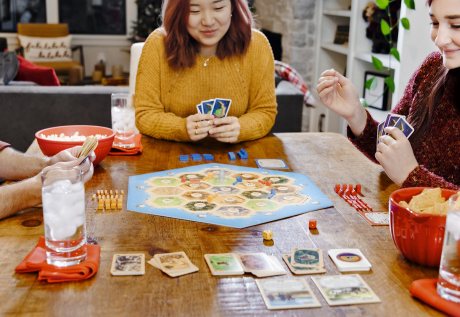
What are the coordinates of `table` in the screenshot? It's located at (173, 239), (166, 297), (327, 214), (327, 162).